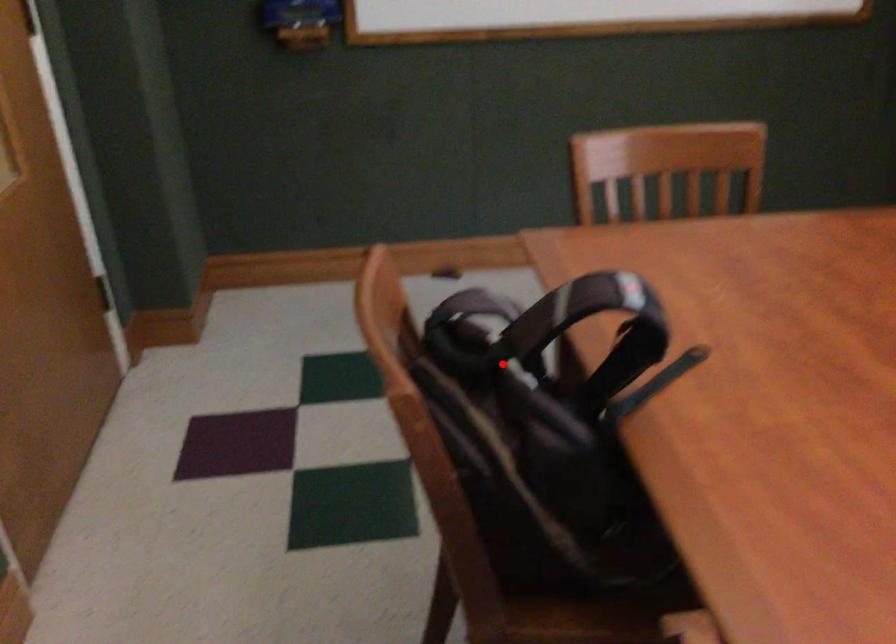
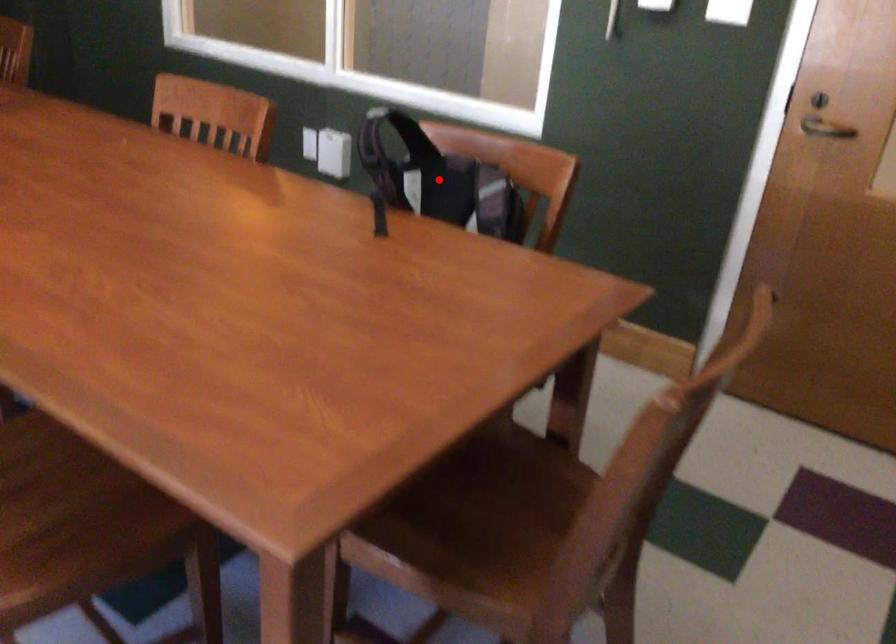
I am providing you with two images of the same scene from different viewpoints. A red point is marked on the first image and another point is marked on the second image. Do the highlighted points in image1 and image2 indicate the same real-world spot?

Yes